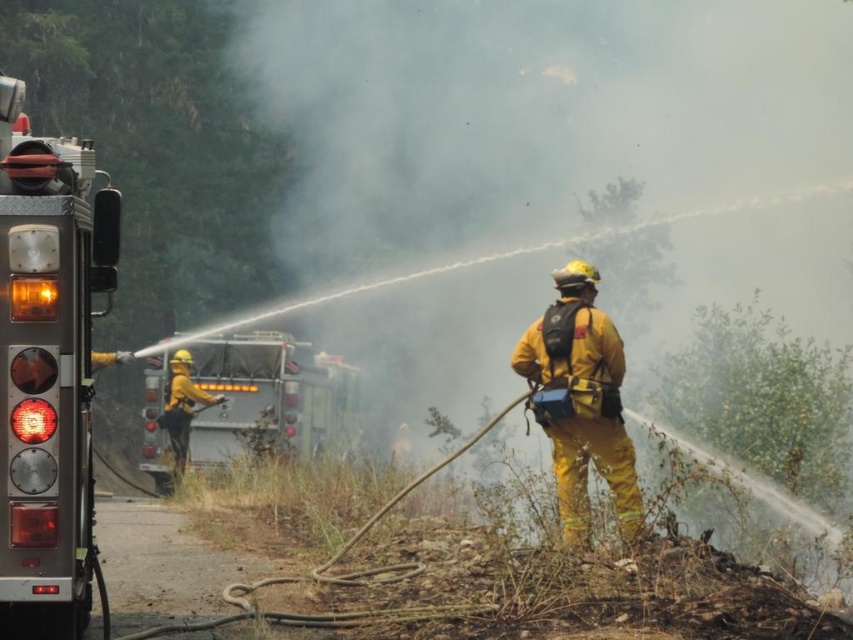
You are a firefighter trying to navigate through the area. You need to pass between the yellow fireproof suit at center and the yellow matte fireman at left. Can you walk through the space between them?

The yellow fireproof suit at center is thinner than the yellow matte fireman at left, so the space between them may be narrow. However, since both are firefighters, they can likely move aside to allow passage. If they remain stationary, the narrower space might make it difficult to pass comfortably.

You are a firefighter who needs to reach the top of the metallic silver fire truck at left to access a water tank. Considering the height of the yellow fireproof suit at center, can you climb up the truck safely?

The metallic silver fire truck at left is taller than the yellow fireproof suit at center, so you can climb up the truck safely as the height difference allows for safe access to the water tank.